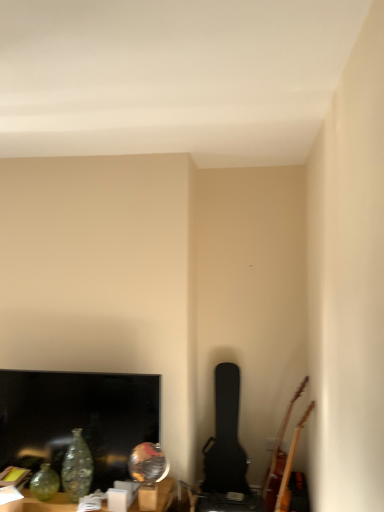
Question: Considering the relative positions of matte black tv at lower left and wooden acoustic guitar at lower right, the second guitar from the left, in the image provided, is matte black tv at lower left to the left of wooden acoustic guitar at lower right, the second guitar from the left, from the viewer's perspective?

Choices:
 (A) yes
 (B) no

Answer: (A)

Question: Is matte black tv at lower left facing towards wooden acoustic guitar at lower right, the second guitar from the left?

Choices:
 (A) yes
 (B) no

Answer: (B)

Question: Is the surface of matte black tv at lower left in direct contact with wooden acoustic guitar at lower right, the second guitar from the left?

Choices:
 (A) no
 (B) yes

Answer: (A)

Question: Is matte black tv at lower left smaller than wooden acoustic guitar at lower right, arranged as the first guitar when viewed from the right?

Choices:
 (A) no
 (B) yes

Answer: (B)

Question: Is matte black tv at lower left further to camera compared to wooden acoustic guitar at lower right, the second guitar from the left?

Choices:
 (A) no
 (B) yes

Answer: (A)

Question: Does matte black tv at lower left come in front of wooden acoustic guitar at lower right, the second guitar from the left?

Choices:
 (A) yes
 (B) no

Answer: (A)

Question: Is translucent glass vase at lower left a part of wooden acoustic guitar at lower right, the second guitar from the left?

Choices:
 (A) no
 (B) yes

Answer: (A)

Question: Is translucent glass vase at lower left at the back of wooden acoustic guitar at lower right, the second guitar from the left?

Choices:
 (A) yes
 (B) no

Answer: (B)

Question: Does wooden acoustic guitar at lower right, the second guitar from the left, turn towards translucent glass vase at lower left?

Choices:
 (A) yes
 (B) no

Answer: (B)

Question: Is wooden acoustic guitar at lower right, arranged as the first guitar when viewed from the right, to the right of translucent glass vase at lower left from the viewer's perspective?

Choices:
 (A) yes
 (B) no

Answer: (A)

Question: Does wooden acoustic guitar at lower right, arranged as the first guitar when viewed from the right, have a greater width compared to translucent glass vase at lower left?

Choices:
 (A) yes
 (B) no

Answer: (A)

Question: From the image's perspective, is wooden acoustic guitar at lower right, arranged as the first guitar when viewed from the right, located beneath translucent glass vase at lower left?

Choices:
 (A) no
 (B) yes

Answer: (B)

Question: From the image's perspective, is matte black tv at lower left beneath translucent glass vase at lower left?

Choices:
 (A) yes
 (B) no

Answer: (B)